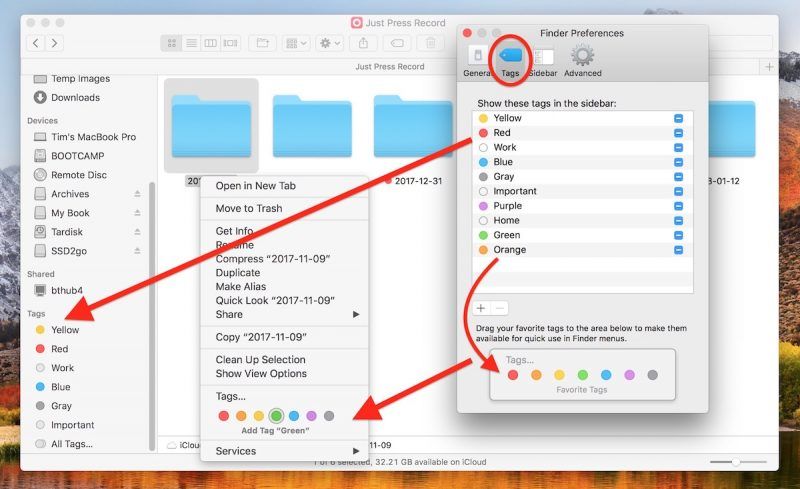
Identify the location of folders. This screenshot has width=800, height=489. (234, 127), (309, 126), (422, 118), (738, 130).